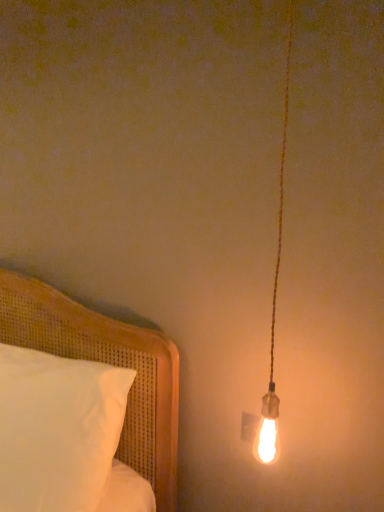
Question: Should I look upward or downward to see white cotton pillow at left?

Choices:
 (A) up
 (B) down

Answer: (B)

Question: Considering the relative sizes of white cotton pillow at left and matte gold bulb at right in the image provided, is white cotton pillow at left taller than matte gold bulb at right?

Choices:
 (A) no
 (B) yes

Answer: (A)

Question: Is the position of white cotton pillow at left less distant than that of matte gold bulb at right?

Choices:
 (A) yes
 (B) no

Answer: (B)

Question: Is white cotton pillow at left at the right side of matte gold bulb at right?

Choices:
 (A) yes
 (B) no

Answer: (B)

Question: Is white cotton pillow at left oriented away from matte gold bulb at right?

Choices:
 (A) yes
 (B) no

Answer: (B)

Question: Considering the relative sizes of white cotton pillow at left and matte gold bulb at right in the image provided, is white cotton pillow at left wider than matte gold bulb at right?

Choices:
 (A) yes
 (B) no

Answer: (A)

Question: From the image's perspective, is white cotton pillow at left beneath matte gold bulb at right?

Choices:
 (A) no
 (B) yes

Answer: (B)

Question: Is the position of matte gold bulb at right more distant than that of white cotton pillow at left?

Choices:
 (A) yes
 (B) no

Answer: (B)

Question: Is matte gold bulb at right bigger than white cotton pillow at left?

Choices:
 (A) yes
 (B) no

Answer: (B)

Question: From a real-world perspective, is matte gold bulb at right beneath white cotton pillow at left?

Choices:
 (A) no
 (B) yes

Answer: (A)

Question: Considering the relative sizes of matte gold bulb at right and white cotton pillow at left in the image provided, is matte gold bulb at right smaller than white cotton pillow at left?

Choices:
 (A) yes
 (B) no

Answer: (A)

Question: From the image's perspective, would you say matte gold bulb at right is positioned over white cotton pillow at left?

Choices:
 (A) yes
 (B) no

Answer: (A)

Question: Is matte gold bulb at right positioned with its back to white cotton pillow at left?

Choices:
 (A) no
 (B) yes

Answer: (A)

Question: Is matte gold bulb at right taller or shorter than white cotton pillow at left?

Choices:
 (A) short
 (B) tall

Answer: (B)